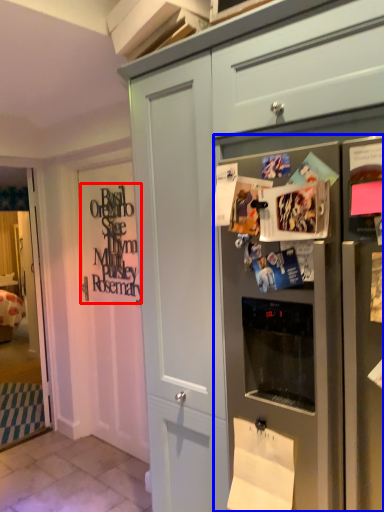
Question: Which object appears closest to the camera in this image, signature (highlighted by a red box) or refrigerator (highlighted by a blue box)?

Choices:
 (A) signature
 (B) refrigerator

Answer: (B)